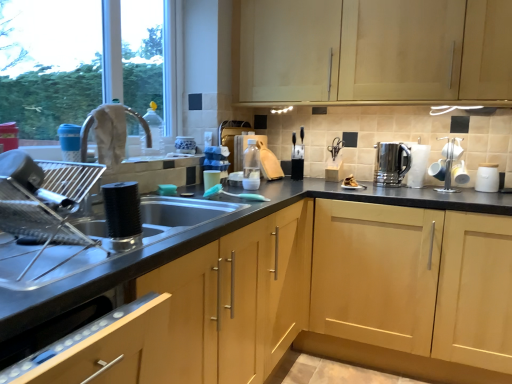
Locate an element on the screen. The width and height of the screenshot is (512, 384). free space in front of matte plastic cup at sink, the first appliance from the front is located at coordinates (199, 197).